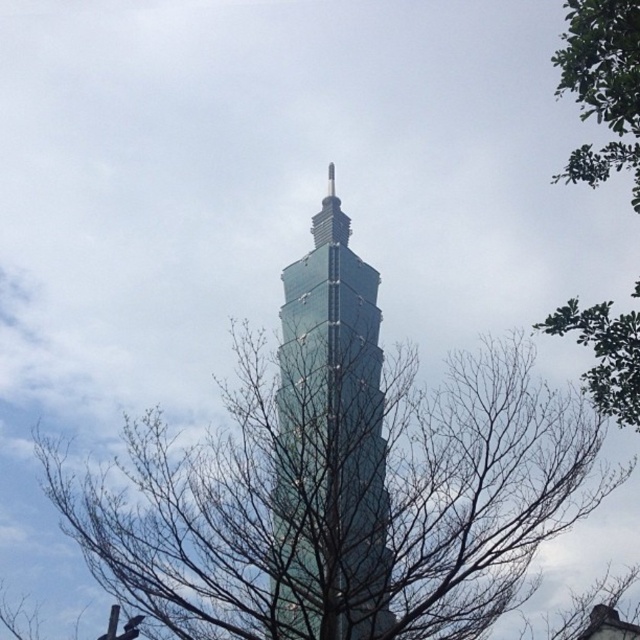
Question: Which object appears farthest from the camera in this image?

Choices:
 (A) green leafy tree at upper right
 (B) bare branches at center

Answer: (A)

Question: Which of the following is the farthest from the observer?

Choices:
 (A) green glass tower at center
 (B) bare branches at center

Answer: (A)

Question: Which is farther from the bare branches at center?

Choices:
 (A) green leafy tree at upper right
 (B) green glass tower at center

Answer: (A)

Question: Is bare branches at center to the right of green leafy tree at upper right from the viewer's perspective?

Choices:
 (A) no
 (B) yes

Answer: (A)

Question: Does green glass tower at center appear on the left side of green leafy tree at upper right?

Choices:
 (A) yes
 (B) no

Answer: (A)

Question: Is bare branches at center in front of green glass tower at center?

Choices:
 (A) no
 (B) yes

Answer: (B)